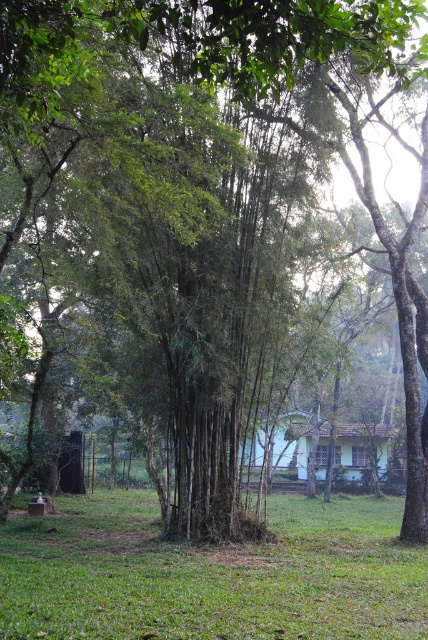
Question: Does green grassy at lower center have a smaller size compared to light green wooden hut at center?

Choices:
 (A) no
 (B) yes

Answer: (B)

Question: Where is green grassy at lower center located in relation to light green wooden hut at center in the image?

Choices:
 (A) below
 (B) above

Answer: (A)

Question: Which point appears closest to the camera in this image?

Choices:
 (A) (157, 620)
 (B) (249, 444)

Answer: (A)

Question: Which of the following is the closest to the observer?

Choices:
 (A) light green wooden hut at center
 (B) green grassy at lower center

Answer: (B)

Question: Is green grassy at lower center bigger than light green wooden hut at center?

Choices:
 (A) yes
 (B) no

Answer: (B)